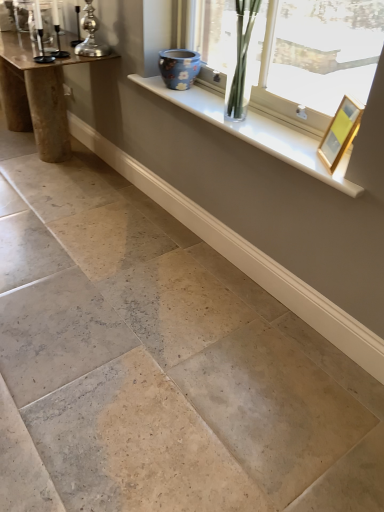
Locate an element on the screen. The width and height of the screenshot is (384, 512). free space to the left of silver metallic candle holder at upper left, the second candle holder viewed from the left is located at coordinates (55, 52).